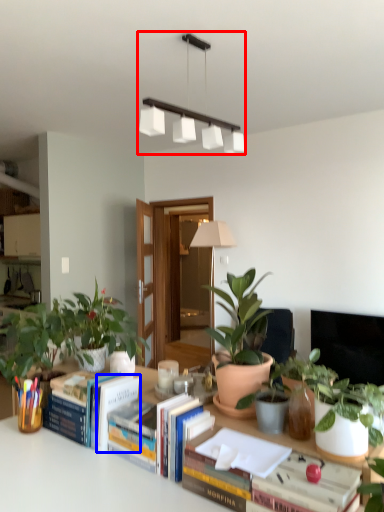
Question: Which object is further to the camera taking this photo, lamp (highlighted by a red box) or paperback book (highlighted by a blue box)?

Choices:
 (A) lamp
 (B) paperback book

Answer: (A)